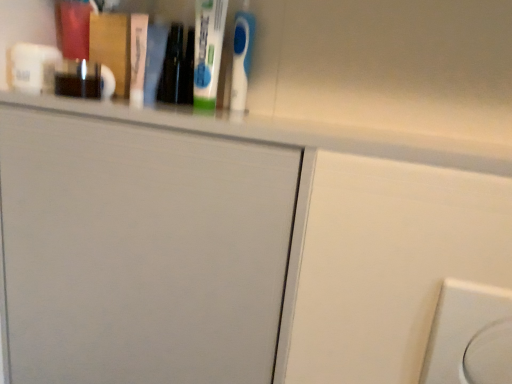
Question: Is white matte door at upper center thinner than white glossy ledge at upper center?

Choices:
 (A) no
 (B) yes

Answer: (B)

Question: Can you confirm if white matte door at upper center is smaller than white glossy ledge at upper center?

Choices:
 (A) no
 (B) yes

Answer: (A)

Question: Is white glossy ledge at upper center located within white matte door at upper center?

Choices:
 (A) yes
 (B) no

Answer: (B)

Question: Is white matte door at upper center outside white glossy ledge at upper center?

Choices:
 (A) no
 (B) yes

Answer: (B)

Question: From a real-world perspective, is white matte door at upper center located beneath white glossy ledge at upper center?

Choices:
 (A) yes
 (B) no

Answer: (A)

Question: Is white glossy ledge at upper center to the left or to the right of white plastic electric outlet at lower right in the image?

Choices:
 (A) left
 (B) right

Answer: (A)

Question: Based on their sizes in the image, would you say white glossy ledge at upper center is bigger or smaller than white plastic electric outlet at lower right?

Choices:
 (A) big
 (B) small

Answer: (A)

Question: Is white glossy ledge at upper center in front of or behind white plastic electric outlet at lower right in the image?

Choices:
 (A) behind
 (B) front

Answer: (A)

Question: Is white glossy ledge at upper center taller or shorter than white plastic electric outlet at lower right?

Choices:
 (A) tall
 (B) short

Answer: (B)

Question: Is white matte door at upper center situated inside white glossy ledge at upper center or outside?

Choices:
 (A) inside
 (B) outside

Answer: (B)

Question: Is white matte door at upper center taller or shorter than white glossy ledge at upper center?

Choices:
 (A) tall
 (B) short

Answer: (A)

Question: Considering their positions, is white matte door at upper center located in front of or behind white glossy ledge at upper center?

Choices:
 (A) front
 (B) behind

Answer: (B)

Question: From a real-world perspective, is white matte door at upper center above or below white glossy ledge at upper center?

Choices:
 (A) below
 (B) above

Answer: (A)

Question: In the image, is white plastic electric outlet at lower right positioned in front of or behind white matte door at upper center?

Choices:
 (A) behind
 (B) front

Answer: (B)

Question: Is white plastic electric outlet at lower right taller or shorter than white matte door at upper center?

Choices:
 (A) short
 (B) tall

Answer: (A)